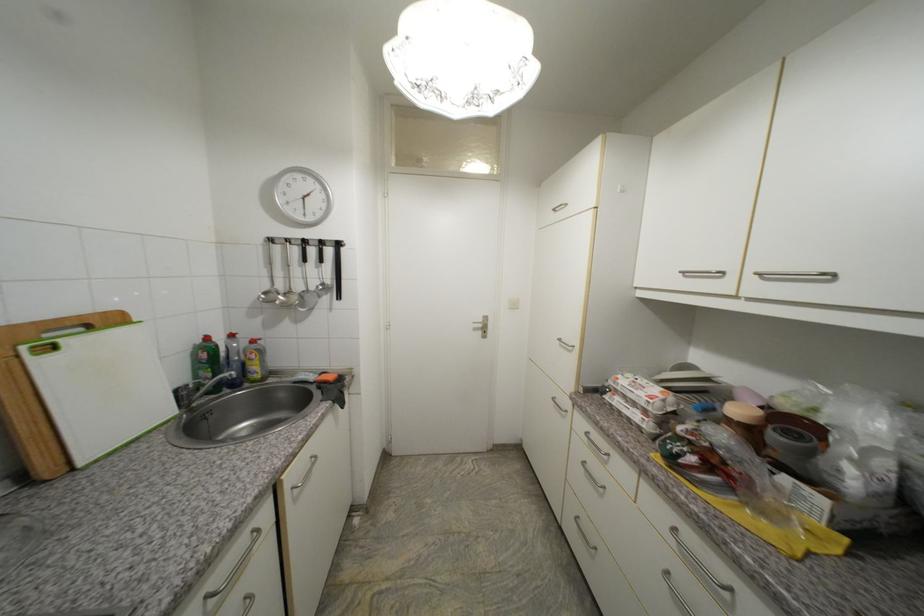
What do you see at coordinates (205, 361) in the screenshot? Image resolution: width=924 pixels, height=616 pixels. I see `a green soap bottle` at bounding box center [205, 361].